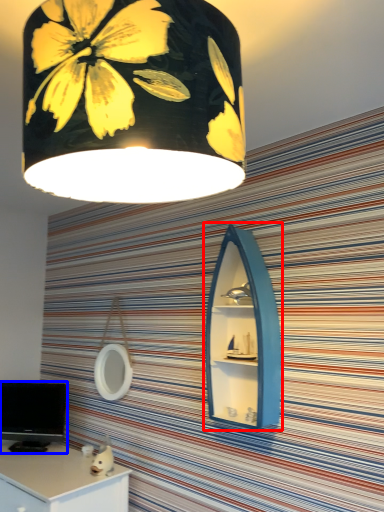
Question: Which object is further to the camera taking this photo, medicine cabinet (highlighted by a red box) or computer monitor (highlighted by a blue box)?

Choices:
 (A) medicine cabinet
 (B) computer monitor

Answer: (B)